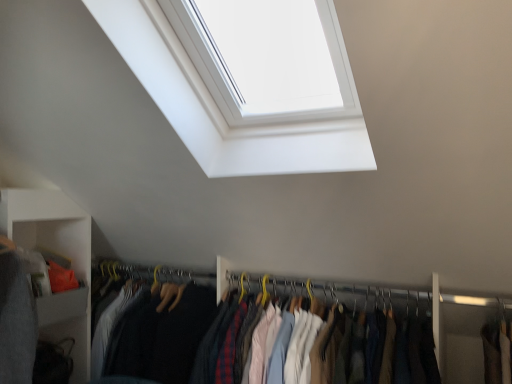
Question: Is there a large distance between white glossy window at upper center and matte fabric clothes at center?

Choices:
 (A) yes
 (B) no

Answer: (B)

Question: Is white glossy window at upper center smaller than matte fabric clothes at center?

Choices:
 (A) no
 (B) yes

Answer: (A)

Question: Can you confirm if white glossy window at upper center is wider than matte fabric clothes at center?

Choices:
 (A) yes
 (B) no

Answer: (A)

Question: From the image's perspective, is white glossy window at upper center above matte fabric clothes at center?

Choices:
 (A) no
 (B) yes

Answer: (B)

Question: From a real-world perspective, is white glossy window at upper center under matte fabric clothes at center?

Choices:
 (A) no
 (B) yes

Answer: (A)

Question: Based on their sizes in the image, would you say yellow metal hanger at center is bigger or smaller than matte gray cabinet at lower left?

Choices:
 (A) small
 (B) big

Answer: (A)

Question: From a real-world perspective, is yellow metal hanger at center positioned above or below matte gray cabinet at lower left?

Choices:
 (A) above
 (B) below

Answer: (B)

Question: Considering the positions of point (373, 291) and point (76, 276), is point (373, 291) closer or farther from the camera than point (76, 276)?

Choices:
 (A) closer
 (B) farther

Answer: (A)

Question: Is yellow metal hanger at center wider or thinner than matte gray cabinet at lower left?

Choices:
 (A) thin
 (B) wide

Answer: (A)

Question: Would you say matte gray cabinet at lower left is inside or outside matte fabric clothes at center?

Choices:
 (A) inside
 (B) outside

Answer: (B)

Question: From a real-world perspective, is matte gray cabinet at lower left physically located above or below matte fabric clothes at center?

Choices:
 (A) below
 (B) above

Answer: (B)

Question: Is matte gray cabinet at lower left bigger or smaller than matte fabric clothes at center?

Choices:
 (A) small
 (B) big

Answer: (A)

Question: Based on their positions, is matte gray cabinet at lower left located to the left or right of matte fabric clothes at center?

Choices:
 (A) right
 (B) left

Answer: (B)

Question: In terms of size, does matte gray cabinet at lower left appear bigger or smaller than white glossy window at upper center?

Choices:
 (A) big
 (B) small

Answer: (B)

Question: Visually, is matte gray cabinet at lower left positioned to the left or to the right of white glossy window at upper center?

Choices:
 (A) right
 (B) left

Answer: (B)